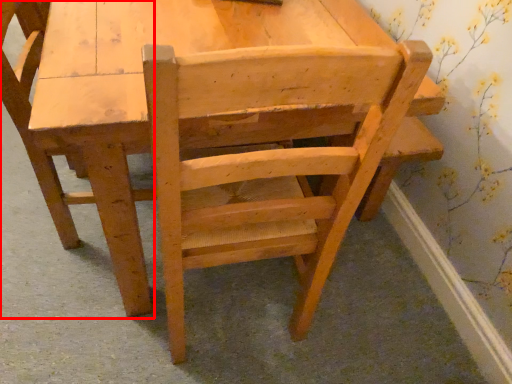
Question: From the image, what is the correct spatial relationship of chair (annotated by the red box) in relation to chair?

Choices:
 (A) right
 (B) left

Answer: (B)